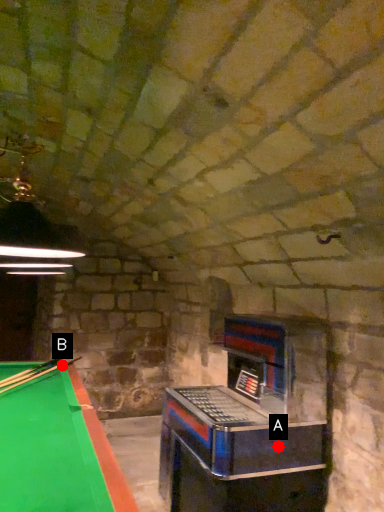
Question: Two points are circled on the image, labeled by A and B beside each circle. Which of the following is the closest to the observer?

Choices:
 (A) A is closer
 (B) B is closer

Answer: (A)